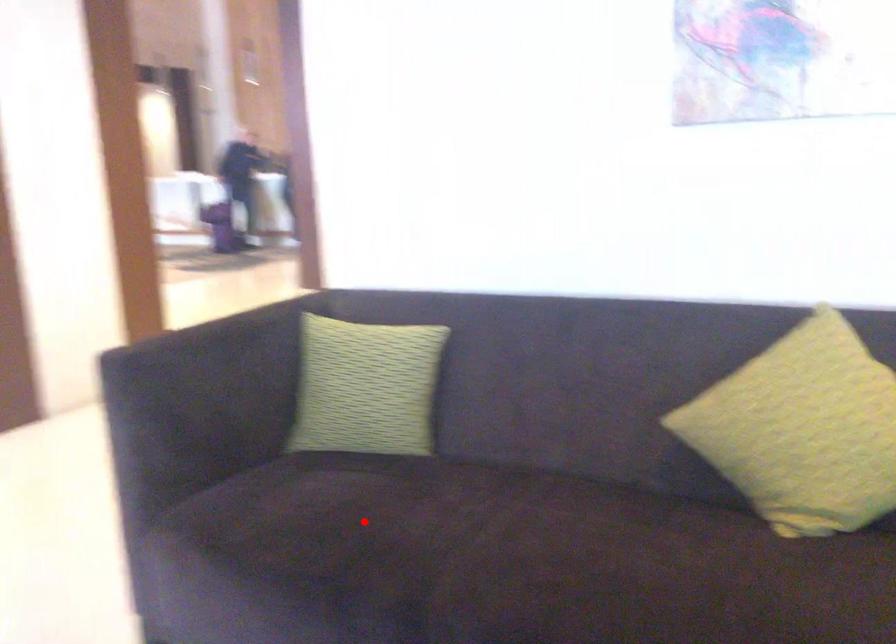
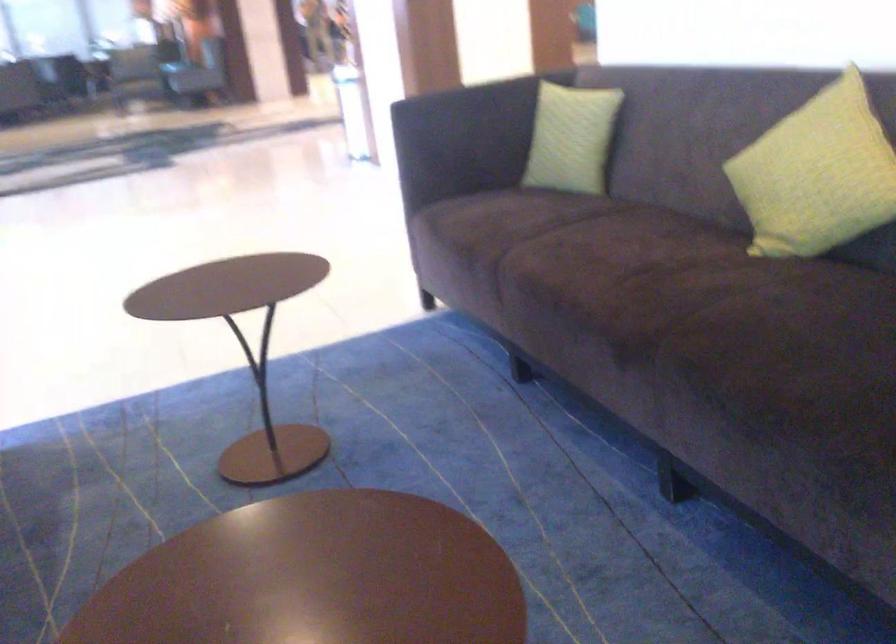
Question: A red point is marked in image1. In image2, is the corresponding 3D point closer to the camera or farther? Reply with the corresponding letter.

Choices:
 (A) The corresponding 3D point is closer.
 (B) The corresponding 3D point is farther.

Answer: (B)